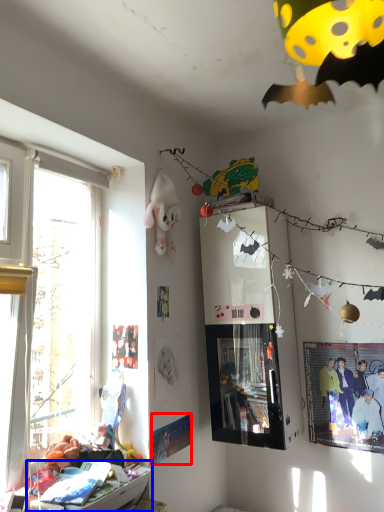
Question: Which point is closer to the camera, poster page (highlighted by a red box) or furniture (highlighted by a blue box)?

Choices:
 (A) poster page
 (B) furniture

Answer: (B)